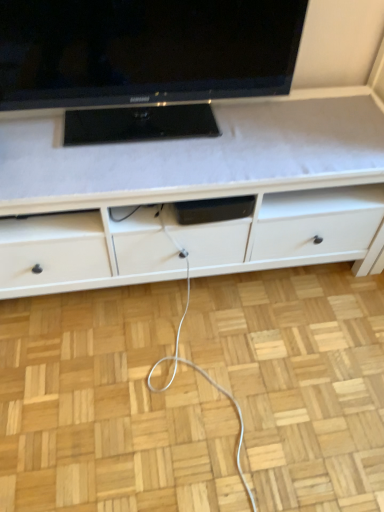
The width and height of the screenshot is (384, 512). In order to click on blank space above white matte cabinet at center (from a real-world perspective) in this screenshot , I will do click(x=185, y=133).